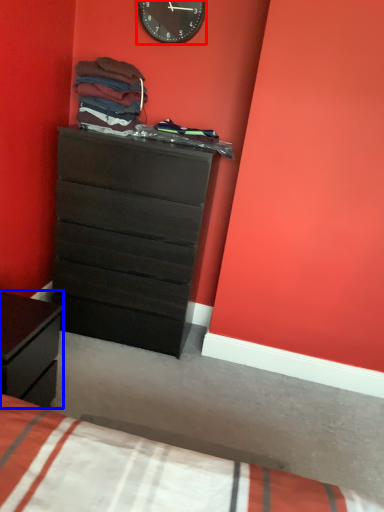
Question: Which object is closer to the camera taking this photo, wall clock (highlighted by a red box) or nightstand (highlighted by a blue box)?

Choices:
 (A) wall clock
 (B) nightstand

Answer: (B)